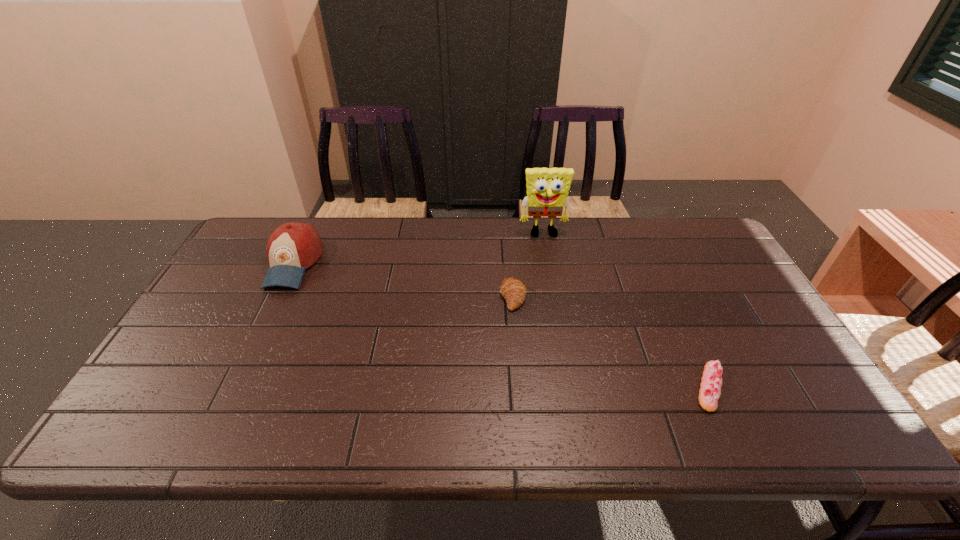
In order to click on object that ranks as the third closest to the crescent roll in this screenshot , I will do `click(293, 247)`.

You are a GUI agent. You are given a task and a screenshot of the screen. Output one action in this format:
    pyautogui.click(x=<x>, y=<y>)
    Task: Click on the object that can be found as the second closest to the sponge
    
    Given the screenshot: What is the action you would take?
    pyautogui.click(x=711, y=382)

At what (x,y) coordinates should I click in order to perform the action: click on free location that satisfies the following two spatial constraints: 1. on the front-facing side of the third tallest object; 2. on the left side of the baseball cap. Please return your answer as a coordinate pair (x, y). The width and height of the screenshot is (960, 540). Looking at the image, I should click on (277, 296).